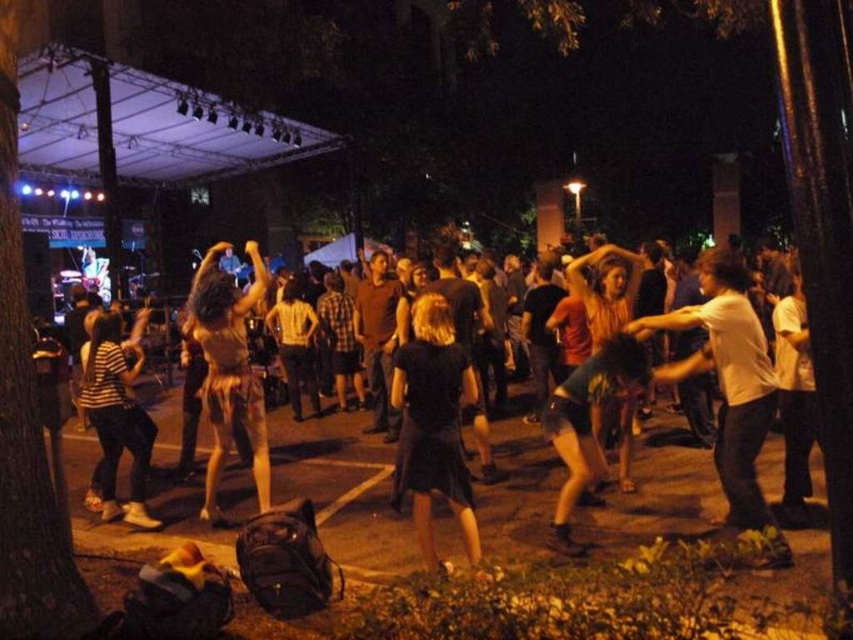
Can you confirm if black cotton dress at center is smaller than brown textured skirt at center?

Yes.

Does black cotton dress at center appear on the left side of brown textured skirt at center?

No, black cotton dress at center is not to the left of brown textured skirt at center.

You are a GUI agent. You are given a task and a screenshot of the screen. Output one action in this format:
    pyautogui.click(x=<x>, y=<y>)
    Task: Click on the black cotton dress at center
    The image size is (853, 640).
    Given the screenshot: What is the action you would take?
    pyautogui.click(x=656, y=500)

Is black matte skirt at center positioned in front of brown textured skirt at center?

Yes, it is in front of brown textured skirt at center.

Is black matte skirt at center thinner than brown textured skirt at center?

Correct, black matte skirt at center's width is less than brown textured skirt at center's.

Which is in front, point (403, 381) or point (213, 268)?

Point (403, 381) is in front.

The height and width of the screenshot is (640, 853). What are the coordinates of `black matte skirt at center` in the screenshot? It's located at (434, 422).

Is point (538, 532) farther from camera compared to point (132, 488)?

No, it is in front of (132, 488).

Is black cotton dress at center wider than striped cotton shirt at lower left?

No.

Does point (291, 429) lie in front of point (120, 397)?

No, it is not.

Where is `black cotton dress at center`? This screenshot has width=853, height=640. black cotton dress at center is located at coordinates (656, 500).